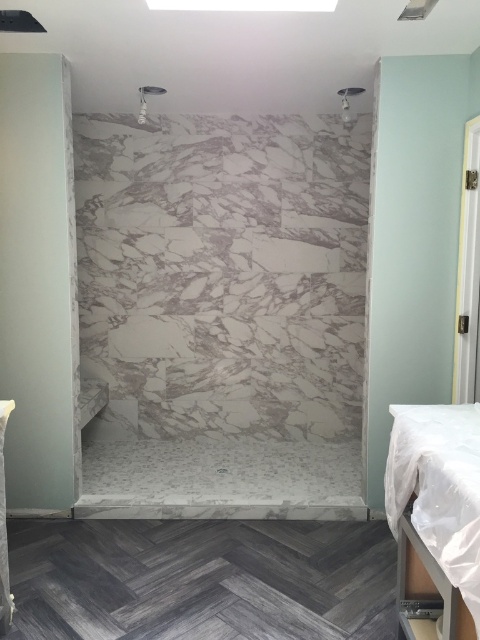
Question: In this image, where is matte white showerhead at upper center located relative to white marble shower at upper center?

Choices:
 (A) left
 (B) right

Answer: (A)

Question: Which of the following is the farthest from the observer?

Choices:
 (A) matte white showerhead at upper center
 (B) white marble shower at upper center
 (C) white fabric bed at lower right

Answer: (A)

Question: Which object appears closest to the camera in this image?

Choices:
 (A) white fabric bed at lower right
 (B) matte white showerhead at upper center
 (C) white marble shower at upper center

Answer: (A)

Question: Which of these objects is positioned farthest from the white marble shower at upper center?

Choices:
 (A) matte white showerhead at upper center
 (B) white fabric bed at lower right

Answer: (B)

Question: Does matte white showerhead at upper center have a larger size compared to white marble shower at upper center?

Choices:
 (A) no
 (B) yes

Answer: (B)

Question: Is matte white showerhead at upper center below white marble shower at upper center?

Choices:
 (A) no
 (B) yes

Answer: (A)